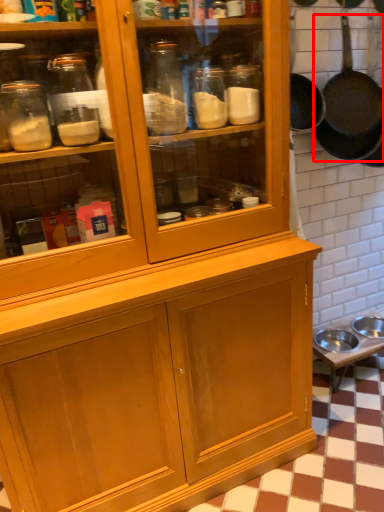
Question: From the image's perspective, where is frying pan (annotated by the red box) located relative to table?

Choices:
 (A) above
 (B) below

Answer: (A)